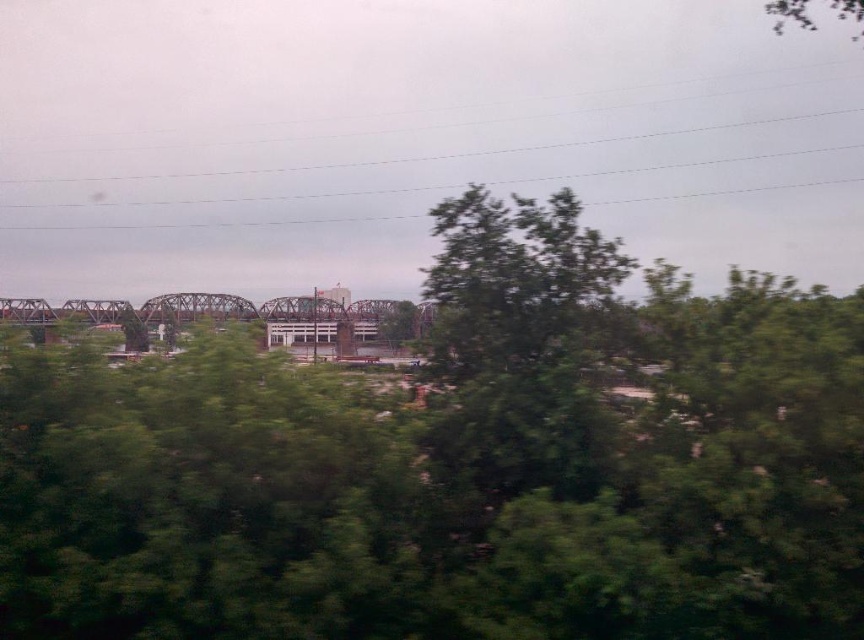
You are a bird flying at the same height as the metallic gray bridge at center. Can you see the top of the green leafy tree at center from your current position?

The green leafy tree at center is taller than the metallic gray bridge at center, so yes, you can see the top of the green leafy tree at center from your current position.

You are a photographer standing 5 meters away from the green leafy tree at center. You want to take a photo of it without any blur. What should you do?

The green leafy tree at center is 6.24 meters away from the camera, so you should move back to ensure the tree is in focus and avoid blur.